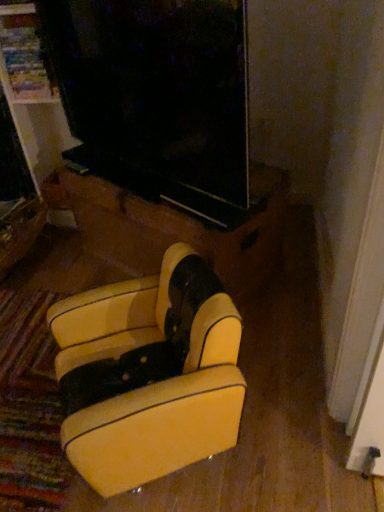
What are the coordinates of `free space to the right of yellow leather armchair at lower center, which ranks as the second furniture in back-to-front order` in the screenshot? It's located at (284, 404).